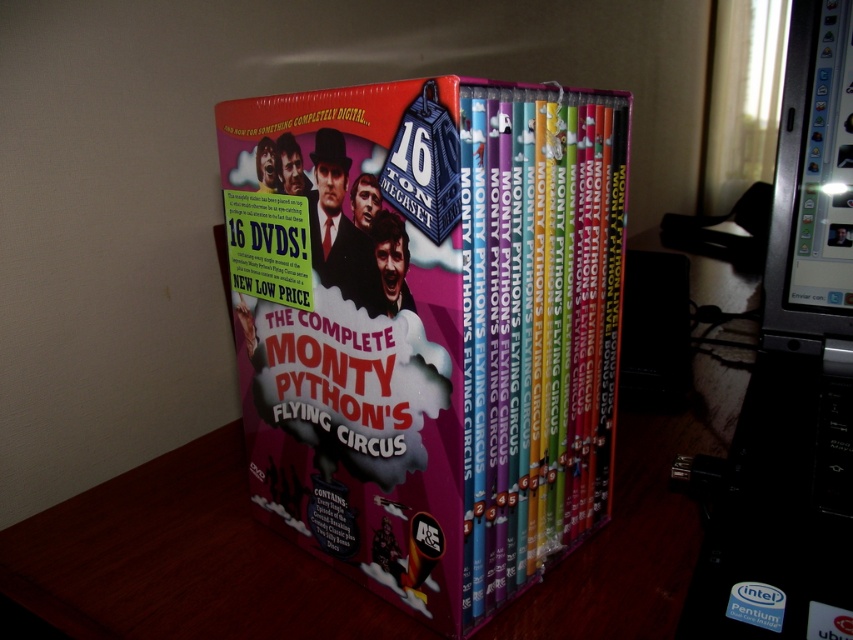
Who is lower down, pink cardboard box at center or black plastic monitor at upper right?

pink cardboard box at center is lower down.

Which is above, pink cardboard box at center or black plastic monitor at upper right?

black plastic monitor at upper right

Describe the element at coordinates (428, 326) in the screenshot. Image resolution: width=853 pixels, height=640 pixels. I see `pink cardboard box at center` at that location.

You are a GUI agent. You are given a task and a screenshot of the screen. Output one action in this format:
    pyautogui.click(x=<x>, y=<y>)
    Task: Click on the pink cardboard box at center
    
    Given the screenshot: What is the action you would take?
    pyautogui.click(x=428, y=326)